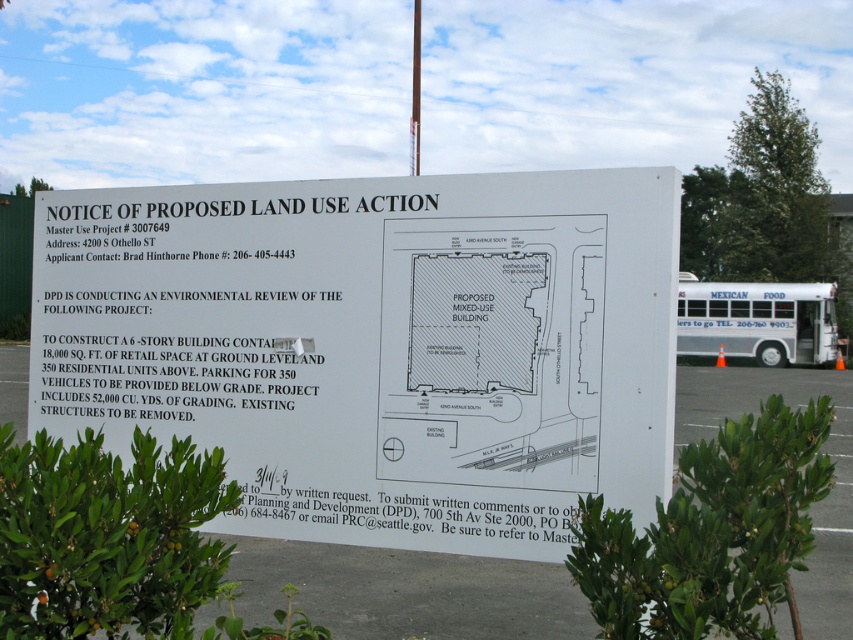
You are a city planner assessing the proposed project. The white concrete parking lot at center and the white metallic bus at center are both depicted in the diagram. Which object is wider according to the diagram?

The white concrete parking lot at center is wider than the white metallic bus at center.

You are standing in front of the white paper sign at center. You want to read the details on the sign without moving closer. Can you read the text clearly from your current position?

The white paper sign at center is 3.66 meters away from the viewer. The typical minimum reading distance for most adults is about 1 meter. Since the distance is greater than the minimum requirement, yes, you can read the text clearly from your current position.